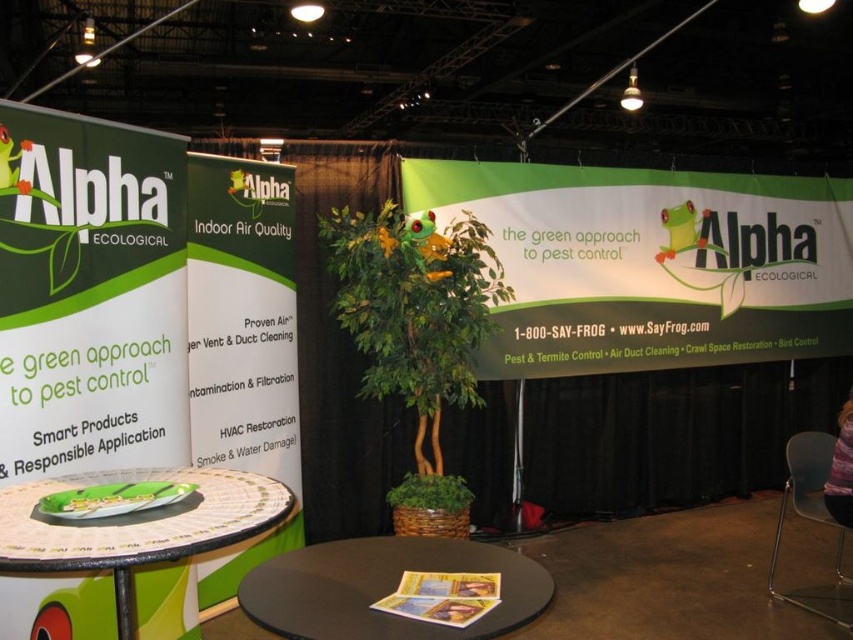
Question: Can you confirm if green fabric banner at center is positioned to the right of green leafy plant at center?

Choices:
 (A) no
 (B) yes

Answer: (B)

Question: Is green fabric banner at center below green glossy plate at center?

Choices:
 (A) no
 (B) yes

Answer: (A)

Question: Estimate the real-world distances between objects in this image. Which object is closer to the green leafy plant at center?

Choices:
 (A) black matte round table at center
 (B) green fabric banner at center
 (C) green glossy plate at center

Answer: (A)

Question: Can you confirm if green glossy plate at center is smaller than gray plastic chair at lower right?

Choices:
 (A) yes
 (B) no

Answer: (A)

Question: Which is nearer to the black matte round table at center?

Choices:
 (A) gray plastic chair at lower right
 (B) green leafy plant at center
 (C) green glossy plate at center
 (D) green fabric banner at center

Answer: (C)

Question: Which of the following is the closest to the observer?

Choices:
 (A) (65, 484)
 (B) (459, 188)

Answer: (A)